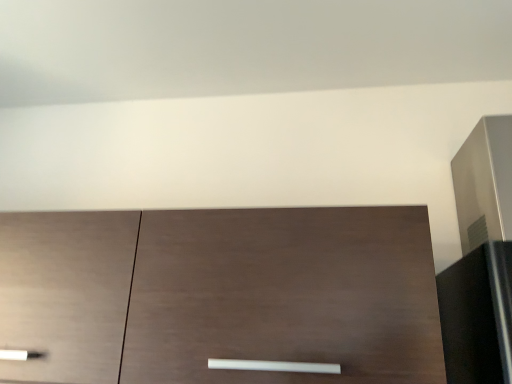
What do you see at coordinates (220, 294) in the screenshot? The width and height of the screenshot is (512, 384). I see `dark wood cupboard at center` at bounding box center [220, 294].

Locate an element on the screen. dark wood cupboard at center is located at coordinates (220, 294).

Find the location of a particular element. The image size is (512, 384). dark wood cupboard at center is located at coordinates click(220, 294).